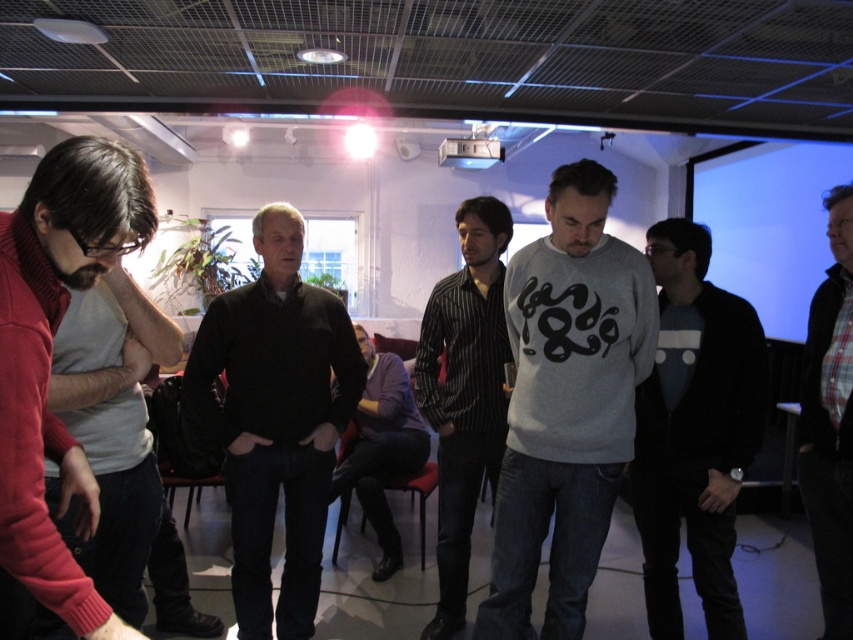
You are a photographer trying to capture a photo of the group. You need to ensure that the gray cotton sweatshirt at center and the matte red sweater at left are both visible in the frame. Based on their positions, which one will appear lower in the photo?

The gray cotton sweatshirt at center appears lower in the photo because it is positioned below the matte red sweater at left.

You are organizing a clothing donation drive and need to categorize the sweaters based on their sizes. Given that the black matte sweater at center and the purple sweater at center are both in the same room, which one would you place in the larger size section?

The black matte sweater at center has a larger width than the purple sweater at center, so it should be placed in the larger size section.

You are a photographer setting up a shoot in this room. You need to place a 1.2m tall tripod between the gray cotton sweatshirt at center and the matte red sweater at left. Can the tripod fit vertically between them without touching either?

The gray cotton sweatshirt at center is taller than the matte red sweater at left. The height difference means the space between them might not be sufficient for a 1.2m tripod. However, since the exact vertical distance isn